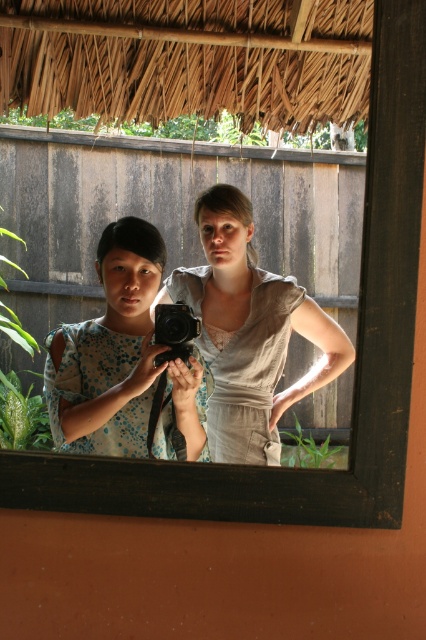
From the picture: Based on the scene description, what are the coordinates of the blue dotted fabric dress at left?

The blue dotted fabric dress at left is located at coordinates point (120, 356).